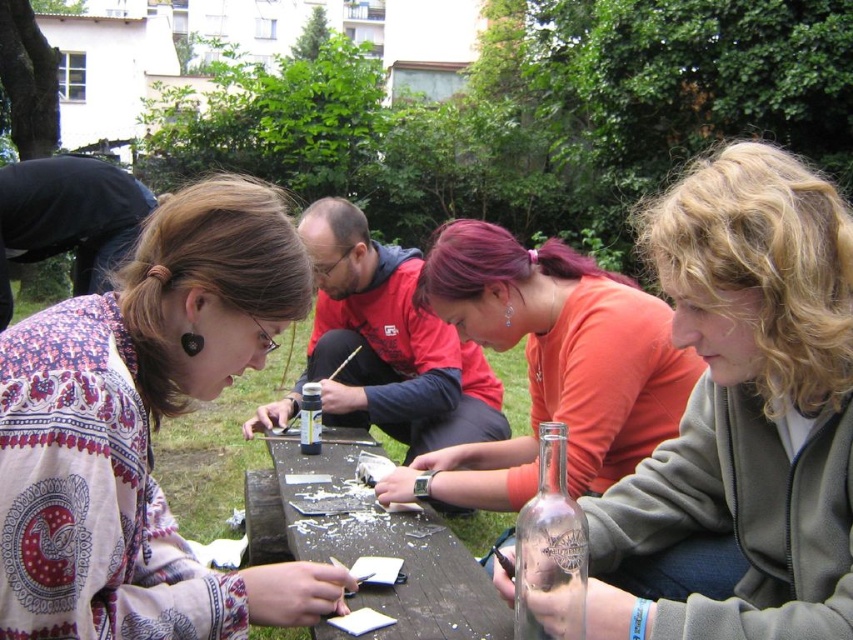
You are organizing an outdoor event and need to ensure that the translucent glass bottle at center can fit on the wooden table at center. Based on the scene description, can you confirm if the bottle will fit on the table?

The translucent glass bottle at center is smaller than the wooden table at center, so it will fit on the table.

From the picture: You are standing in the outdoor area and want to find the wooden table at center. Which direction should you look relative to the patterned fabric shirt at upper left?

The wooden table at center is to the right of the patterned fabric shirt at upper left, so you should look to the right side of the patterned fabric shirt at upper left to find the wooden table at center.